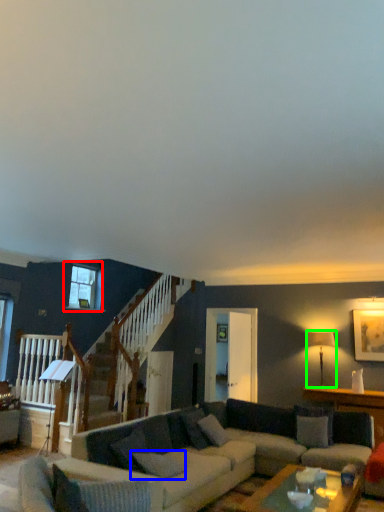
Question: Considering the real-world distances, which object is farthest from window (highlighted by a red box)? pillow (highlighted by a blue box) or lamp (highlighted by a green box)?

Choices:
 (A) pillow
 (B) lamp

Answer: (B)